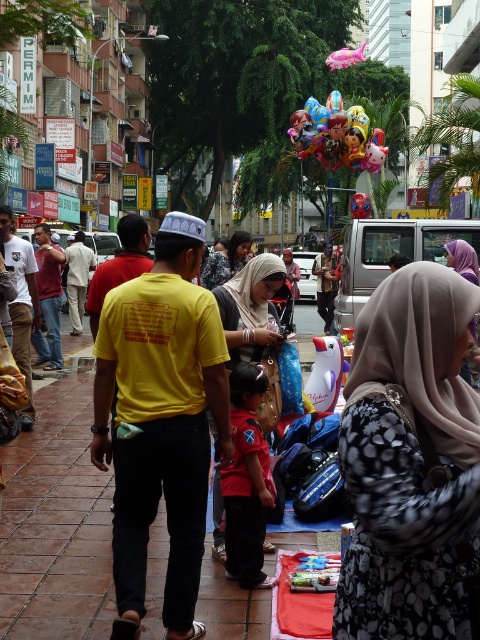
Does floral-patterned hijab at center have a greater height compared to glossy metallic balloons at center?

Correct, floral-patterned hijab at center is much taller as glossy metallic balloons at center.

Between floral-patterned hijab at center and glossy metallic balloons at center, which one appears on the right side from the viewer's perspective?

Positioned to the right is glossy metallic balloons at center.

Which is in front, point (396, 464) or point (315, 148)?

Positioned in front is point (396, 464).

Identify the location of floral-patterned hijab at center. click(x=410, y=461).

Is floral-patterned hijab at center shorter than translucent plastic balloon at center?

Yes, floral-patterned hijab at center is shorter than translucent plastic balloon at center.

Which is below, floral-patterned hijab at center or translucent plastic balloon at center?

floral-patterned hijab at center

Does point (360, 634) lie behind point (368, 200)?

No, (360, 634) is in front of (368, 200).

Locate an element on the screen. The height and width of the screenshot is (640, 480). floral-patterned hijab at center is located at coordinates (410, 461).

Image resolution: width=480 pixels, height=640 pixels. What are the coordinates of `matte beige hijab at center` in the screenshot? It's located at (251, 308).

Who is more distant from viewer, (235, 280) or (337, 108)?

The point (337, 108) is more distant.

I want to click on matte beige hijab at center, so click(x=251, y=308).